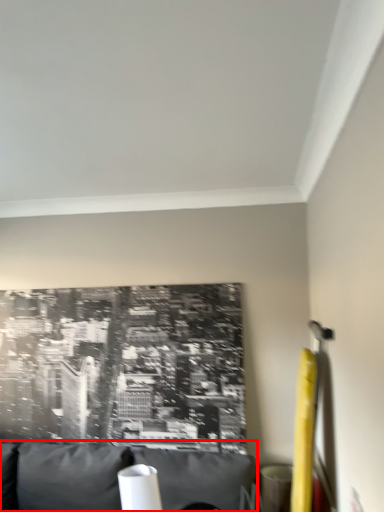
Question: From the image's perspective, considering the relative positions of furniture (annotated by the red box) and table lamp in the image provided, where is furniture (annotated by the red box) located with respect to the staircase?

Choices:
 (A) above
 (B) below

Answer: (B)